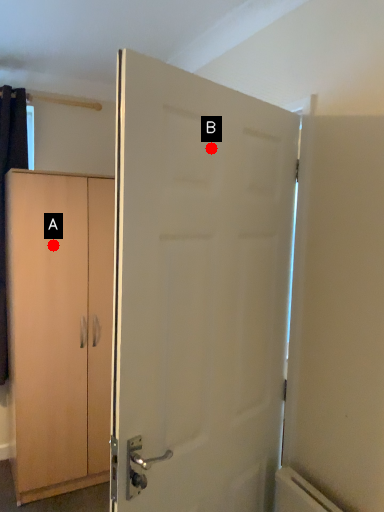
Question: Two points are circled on the image, labeled by A and B beside each circle. Which of the following is the farthest from the observer?

Choices:
 (A) A is further
 (B) B is further

Answer: (A)